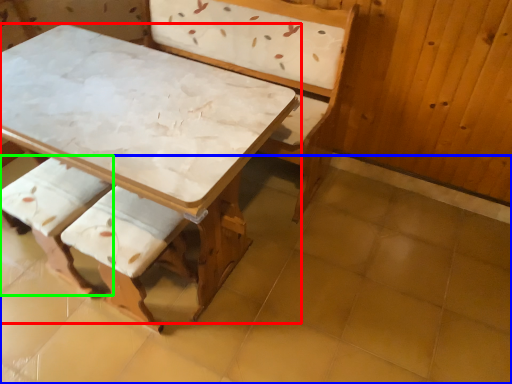
Question: Which is nearer to the table (highlighted by a red box)? tile (highlighted by a blue box) or armchair (highlighted by a green box).

Choices:
 (A) tile
 (B) armchair

Answer: (B)